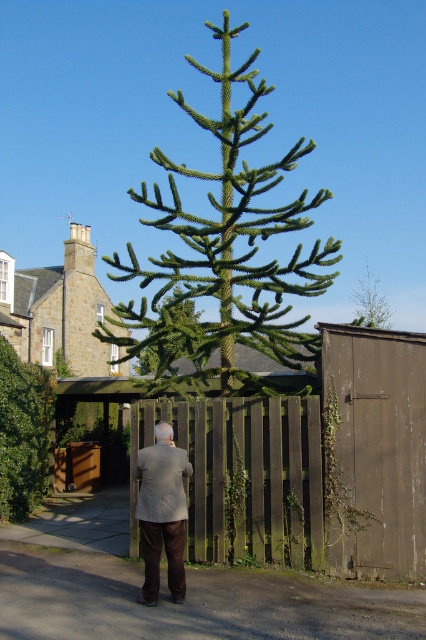
You are a gardener who needs to water both the green spiky tree at center and the green leafy bush at lower left. Which one should you water first if you want to start from the lowest point in the scene?

The green leafy bush at lower left should be watered first since it is positioned lower than the green spiky tree at center.

You are a photographer trying to capture the gray wool coat at center and the green leafy tree at upper center in the same frame. Based on their sizes, which object will appear smaller in the photo?

The gray wool coat at center will appear smaller in the photo because it is shorter than the green leafy tree at upper center.